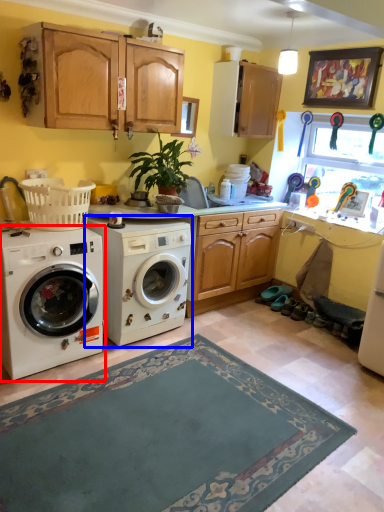
Question: Which point is closer to the camera, washing machine (highlighted by a red box) or washing machine (highlighted by a blue box)?

Choices:
 (A) washing machine
 (B) washing machine

Answer: (A)